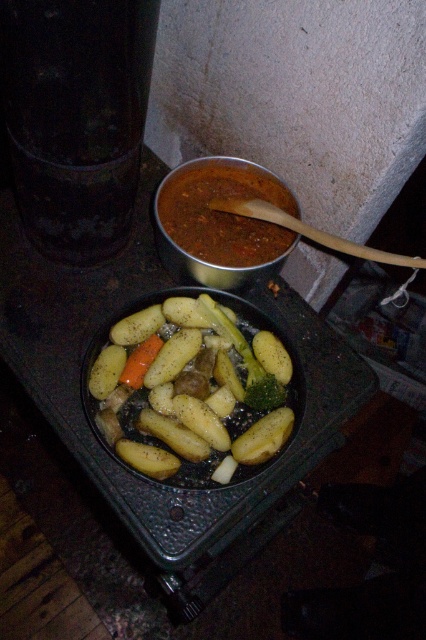
Question: Does smooth yellow potatoes at center appear on the left side of brown matte soup at center?

Choices:
 (A) no
 (B) yes

Answer: (B)

Question: Which object is farther from the camera taking this photo?

Choices:
 (A) smooth yellow potatoes at center
 (B) brown matte soup at center
 (C) green matte broccoli at center

Answer: (B)

Question: Does brown matte soup at center lie in front of green matte broccoli at center?

Choices:
 (A) no
 (B) yes

Answer: (A)

Question: Can you confirm if brown matte soup at center is wider than green matte broccoli at center?

Choices:
 (A) yes
 (B) no

Answer: (A)

Question: Which point is closer to the camera taking this photo?

Choices:
 (A) (207, 314)
 (B) (166, 228)

Answer: (A)

Question: Which point is farther to the camera?

Choices:
 (A) (135, 458)
 (B) (247, 401)

Answer: (B)